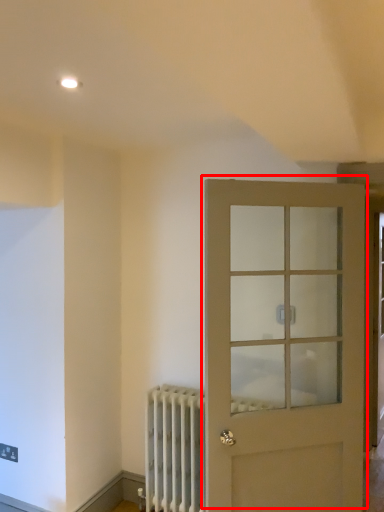
Question: From the image's perspective, considering the relative positions of door (annotated by the red box) and radiator in the image provided, where is door (annotated by the red box) located with respect to the staircase?

Choices:
 (A) below
 (B) above

Answer: (B)